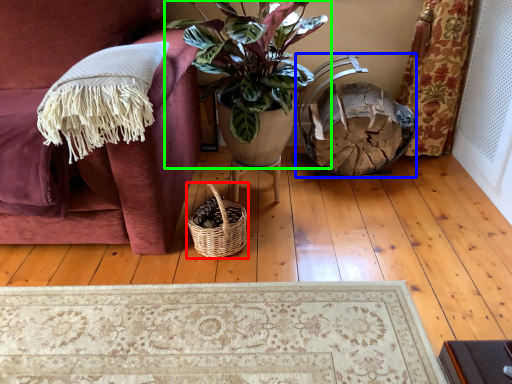
Question: Which object is the farthest from picnic basket (highlighted by a red box)? Choose among these: rocking chair (highlighted by a blue box) or houseplant (highlighted by a green box).

Choices:
 (A) rocking chair
 (B) houseplant

Answer: (A)